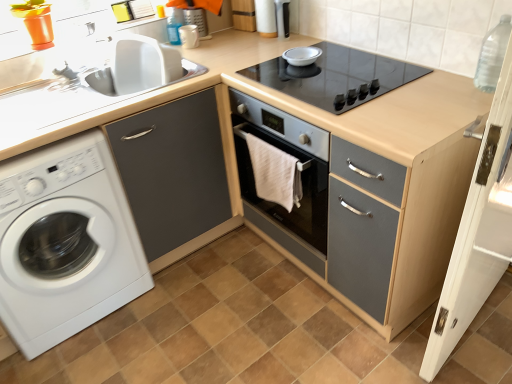
The image size is (512, 384). What do you see at coordinates (394, 191) in the screenshot?
I see `matte gray cabinet at center` at bounding box center [394, 191].

Describe the element at coordinates (85, 81) in the screenshot. I see `white glossy sink at upper left` at that location.

Where is `black glass cooktop at center`? The image size is (512, 384). black glass cooktop at center is located at coordinates (336, 77).

Where is `white towel at center`? Image resolution: width=512 pixels, height=384 pixels. white towel at center is located at coordinates (274, 173).

From the picture: Is metallic silver toaster at upper center, which is the 2th appliance from left to right, spatially inside white glossy sink at upper left, or outside of it?

metallic silver toaster at upper center, which is the 2th appliance from left to right, lies outside white glossy sink at upper left.

Locate an element on the screen. The height and width of the screenshot is (384, 512). the 2nd appliance above the white glossy sink at upper left (from the image's perspective) is located at coordinates (282, 18).

Is metallic silver toaster at upper center, the first appliance viewed from the right, directly adjacent to white glossy sink at upper left?

metallic silver toaster at upper center, the first appliance viewed from the right, and white glossy sink at upper left are clearly separated.

From the image's perspective, which one is positioned lower, metallic silver toaster at upper center, which is the 2th appliance from left to right, or white glossy sink at upper left?

white glossy sink at upper left is shown below in the image.

Is matte gray cabinet at left positioned far away from metallic silver toaster at upper center, the first appliance viewed from the right?

No.

From the image's perspective, does matte gray cabinet at left appear higher than metallic silver toaster at upper center, which is the 2th appliance from left to right?

Incorrect, from the image's perspective, matte gray cabinet at left is lower than metallic silver toaster at upper center, which is the 2th appliance from left to right.

Is matte gray cabinet at left spatially inside metallic silver toaster at upper center, which is the 2th appliance from left to right, or outside of it?

matte gray cabinet at left is not enclosed by metallic silver toaster at upper center, which is the 2th appliance from left to right.

Does transparent plastic bottle at upper right have a larger size compared to metallic silver toaster at upper center, the first appliance viewed from the right?

Correct, transparent plastic bottle at upper right is larger in size than metallic silver toaster at upper center, the first appliance viewed from the right.

Does transparent plastic bottle at upper right have a greater width compared to metallic silver toaster at upper center, which is the 2th appliance from left to right?

Indeed, transparent plastic bottle at upper right has a greater width compared to metallic silver toaster at upper center, which is the 2th appliance from left to right.

Is transparent plastic bottle at upper right placed right next to metallic silver toaster at upper center, the first appliance viewed from the right?

No, transparent plastic bottle at upper right is not making contact with metallic silver toaster at upper center, the first appliance viewed from the right.

Which of these two, transparent plastic bottle at upper right or metallic silver toaster at upper center, which is the 2th appliance from left to right, stands shorter?

With less height is metallic silver toaster at upper center, which is the 2th appliance from left to right.

Which of these two, metallic silver toaster at upper center, which is the 2th appliance from left to right, or transparent plastic bottle at upper right, is bigger?

Bigger between the two is transparent plastic bottle at upper right.

Can you tell me how much metallic silver toaster at upper center, the first appliance viewed from the right, and transparent plastic bottle at upper right differ in facing direction?

metallic silver toaster at upper center, the first appliance viewed from the right, and transparent plastic bottle at upper right are facing 0.378 degrees away from each other.

From the picture: Which object is wider, metallic silver toaster at upper center, the first appliance viewed from the right, or transparent plastic bottle at upper right?

With larger width is transparent plastic bottle at upper right.

Is metallic silver toaster at upper center, which is the 2th appliance from left to right, touching transparent plastic bottle at upper right?

metallic silver toaster at upper center, which is the 2th appliance from left to right, and transparent plastic bottle at upper right are clearly separated.

Would you consider matte white mug at upper center, the second appliance when ordered from right to left, to be distant from white towel at center?

No, matte white mug at upper center, the second appliance when ordered from right to left, is in close proximity to white towel at center.

Looking at this image, is matte white mug at upper center, marked as the 1th appliance in a left-to-right arrangement, in front of or behind white towel at center in the image?

matte white mug at upper center, marked as the 1th appliance in a left-to-right arrangement, is behind white towel at center.

Considering the sizes of matte white mug at upper center, the second appliance when ordered from right to left, and white towel at center in the image, is matte white mug at upper center, the second appliance when ordered from right to left, bigger or smaller than white towel at center?

Clearly, matte white mug at upper center, the second appliance when ordered from right to left, is smaller in size than white towel at center.

Is matte white mug at upper center, marked as the 1th appliance in a left-to-right arrangement, wider or thinner than white towel at center?

Considering their sizes, matte white mug at upper center, marked as the 1th appliance in a left-to-right arrangement, looks broader than white towel at center.

From a real-world perspective, is white matte washing machine at left beneath transparent plastic bottle at upper right?

Yes, from a real-world perspective, white matte washing machine at left is under transparent plastic bottle at upper right.

What's the angular difference between white matte washing machine at left and transparent plastic bottle at upper right's facing directions?

The angular difference between white matte washing machine at left and transparent plastic bottle at upper right is 90 degrees.

Considering the sizes of objects white matte washing machine at left and transparent plastic bottle at upper right in the image provided, who is thinner, white matte washing machine at left or transparent plastic bottle at upper right?

Thinner between the two is transparent plastic bottle at upper right.

Between point (42, 179) and point (503, 40), which one is positioned in front?

Positioned in front is point (503, 40).

I want to click on the 2nd appliance counting from the left side of the black glass cooktop at center, so click(x=189, y=36).

Can you tell me how much black glass cooktop at center and matte white mug at upper center, the second appliance when ordered from right to left, differ in facing direction?

The facing directions of black glass cooktop at center and matte white mug at upper center, the second appliance when ordered from right to left, are 88.1 degrees apart.

Is black glass cooktop at center bigger than matte white mug at upper center, the second appliance when ordered from right to left?

Yes, black glass cooktop at center is bigger than matte white mug at upper center, the second appliance when ordered from right to left.

Which point is more distant from viewer, (355,89) or (196,32)?

Positioned behind is point (196,32).

Identify the location of sink located underneath the metallic silver toaster at upper center, the first appliance viewed from the right (from a real-world perspective). (85, 81).

Locate an element on the screen. The height and width of the screenshot is (384, 512). cabinetry lying below the metallic silver toaster at upper center, the first appliance viewed from the right (from the image's perspective) is located at coordinates coord(174,175).

Which object lies further to the anchor point white glossy sink at upper left, matte white mug at upper center, marked as the 1th appliance in a left-to-right arrangement, or white matte washing machine at left?

The object further to white glossy sink at upper left is white matte washing machine at left.

From the picture: From the image, which object appears to be farther from white wood screen door at right, white glossy sink at upper left or white matte washing machine at left?

white glossy sink at upper left lies further to white wood screen door at right than the other object.

Based on their spatial positions, is transparent plastic bottle at upper right or matte gray cabinet at left closer to white towel at center?

matte gray cabinet at left.

Considering their positions, is white towel at center positioned further to black glass cooktop at center than transparent plastic bottle at upper right?

Among the two, transparent plastic bottle at upper right is located further to black glass cooktop at center.

Looking at the image, which one is located closer to white wood screen door at right, transparent plastic bottle at upper right or white towel at center?

The object closer to white wood screen door at right is transparent plastic bottle at upper right.

Based on their spatial positions, is black glass cooktop at center or white glossy sink at upper left further from matte white mug at upper center, the second appliance when ordered from right to left?

black glass cooktop at center is positioned further to the anchor matte white mug at upper center, the second appliance when ordered from right to left.

From the image, which object appears to be farther from white glossy sink at upper left, matte white mug at upper center, the second appliance when ordered from right to left, or white towel at center?

white towel at center lies further to white glossy sink at upper left than the other object.

From the picture: Considering their positions, is white matte washing machine at left positioned closer to transparent plastic bottle at upper right than metallic silver toaster at upper center, the first appliance viewed from the right?

The object closer to transparent plastic bottle at upper right is metallic silver toaster at upper center, the first appliance viewed from the right.

Locate an element on the screen. cabinetry situated between white glossy sink at upper left and white wood screen door at right from left to right is located at coordinates [x=174, y=175].

Find the location of `cabinetry between white matte washing machine at left and transparent plastic bottle at upper right in the horizontal direction`. cabinetry between white matte washing machine at left and transparent plastic bottle at upper right in the horizontal direction is located at coordinates (174, 175).

The image size is (512, 384). In order to click on sink between matte white mug at upper center, marked as the 1th appliance in a left-to-right arrangement, and white towel at center, in the vertical direction in this screenshot , I will do `click(85, 81)`.

At what (x,y) coordinates should I click in order to perform the action: click on bottle situated between white towel at center and white wood screen door at right from left to right. Please return your answer as a coordinate pair (x, y). Image resolution: width=512 pixels, height=384 pixels. Looking at the image, I should click on (492, 55).